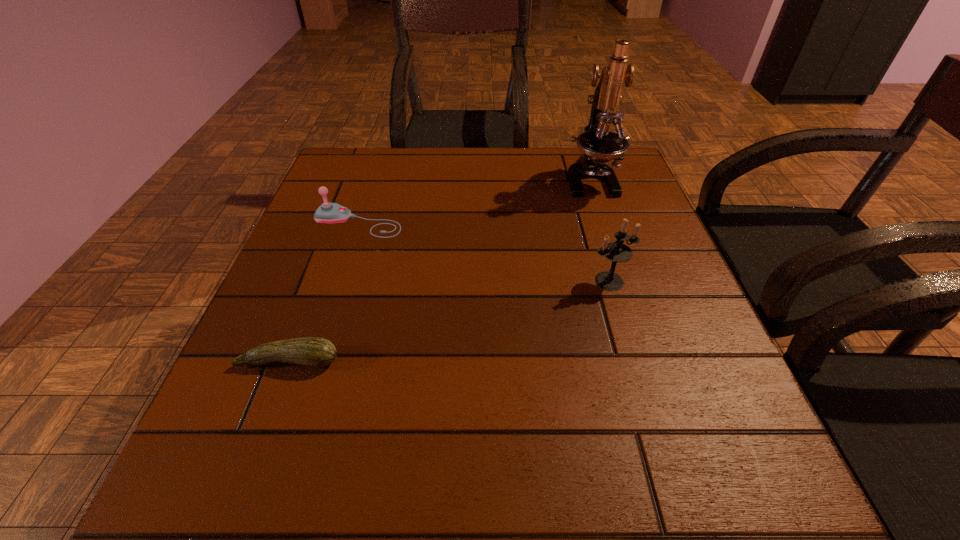
The width and height of the screenshot is (960, 540). What are the coordinates of `vacant space situated on the right of the second shortest object` in the screenshot? It's located at (455, 223).

Locate an element on the screen. vacant space located at the stem end of the nearest object is located at coordinates (231, 513).

Find the location of a particular element. object that is at the far edge is located at coordinates (599, 145).

Identify the location of joystick situated at the left edge. This screenshot has height=540, width=960. (328, 212).

I want to click on zucchini that is at the left edge, so 317,352.

Where is `microscope at the right edge`? The image size is (960, 540). microscope at the right edge is located at coordinates (599, 145).

At what (x,y) coordinates should I click in order to perform the action: click on candle holder that is positioned at the right edge. Please return your answer as a coordinate pair (x, y). Looking at the image, I should click on (616, 251).

The width and height of the screenshot is (960, 540). What are the coordinates of `object at the far right corner` in the screenshot? It's located at (599, 145).

Image resolution: width=960 pixels, height=540 pixels. Identify the location of vacant space at the far edge. (496, 177).

Identify the location of vacant space at the near edge. Image resolution: width=960 pixels, height=540 pixels. (448, 494).